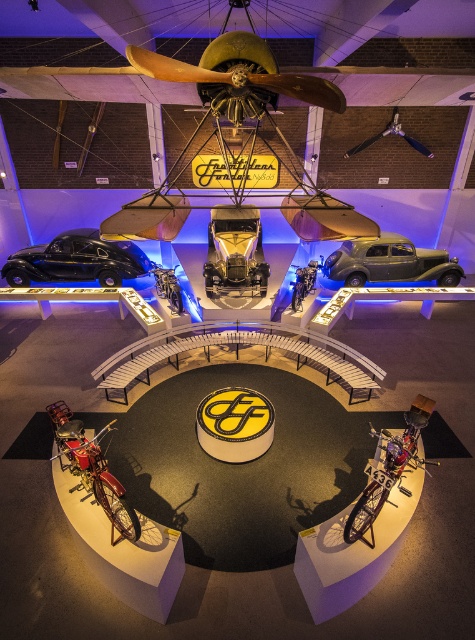
This screenshot has width=475, height=640. Describe the element at coordinates (389, 260) in the screenshot. I see `matte silver car at center` at that location.

Between matte silver car at center and metallic silver propeller at center, which one has less height?

matte silver car at center

Is point (349, 250) farther from viewer compared to point (431, 156)?

Yes, point (349, 250) is behind point (431, 156).

The height and width of the screenshot is (640, 475). What are the coordinates of `matte silver car at center` in the screenshot? It's located at (389, 260).

Describe the element at coordinates (389, 260) in the screenshot. The image size is (475, 640). I see `matte silver car at center` at that location.

Between matte silver car at center and gold metallic car at center, which one is positioned lower?

matte silver car at center is lower down.

Locate an element on the screen. matte silver car at center is located at coordinates (389, 260).

This screenshot has height=640, width=475. Find the location of `matte silver car at center`. matte silver car at center is located at coordinates (389, 260).

Does gold metallic car at center have a greater height compared to metallic silver propeller at center?

Yes, gold metallic car at center is taller than metallic silver propeller at center.

Can you confirm if gold metallic car at center is smaller than metallic silver propeller at center?

No, gold metallic car at center is not smaller than metallic silver propeller at center.

This screenshot has height=640, width=475. In order to click on gold metallic car at center in this screenshot , I will do `click(235, 250)`.